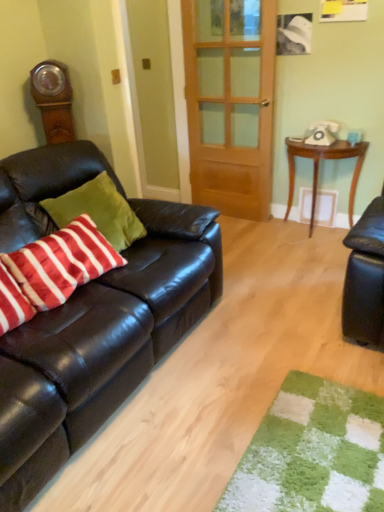
Identify the location of free space in front of wooden door at center. The width and height of the screenshot is (384, 512). (244, 237).